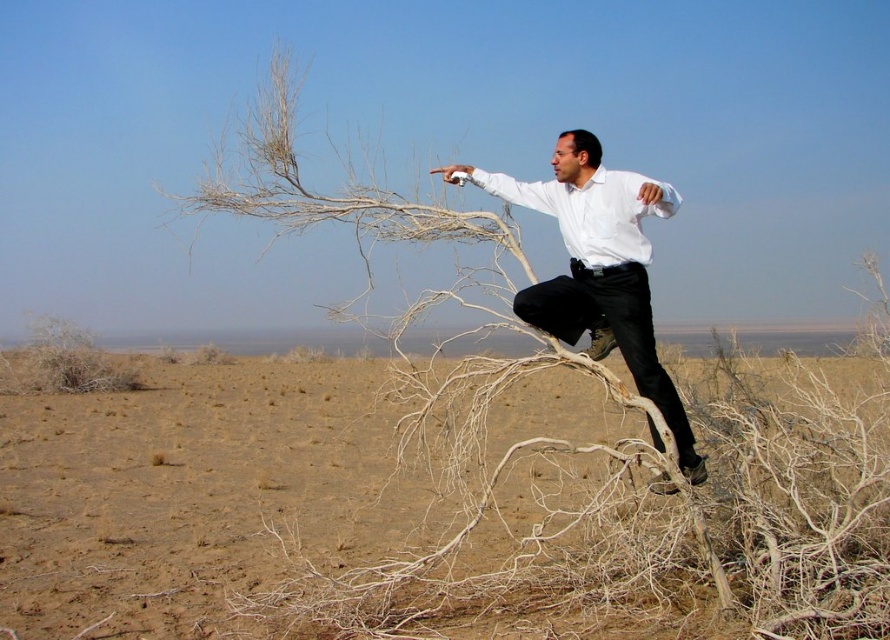
Question: Is brown sandy dirt at center to the right of white matte shirt at center from the viewer's perspective?

Choices:
 (A) yes
 (B) no

Answer: (B)

Question: Which is nearer to the white matte dress shirt at center?

Choices:
 (A) white matte shirt at center
 (B) brown sandy dirt at center

Answer: (A)

Question: In this image, where is brown sandy dirt at center located relative to white matte dress shirt at center?

Choices:
 (A) left
 (B) right

Answer: (A)

Question: Is white matte shirt at center to the right of white matte dress shirt at center from the viewer's perspective?

Choices:
 (A) yes
 (B) no

Answer: (A)

Question: Based on their relative distances, which object is farther from the white matte shirt at center?

Choices:
 (A) white matte dress shirt at center
 (B) brown sandy dirt at center

Answer: (B)

Question: Which object is farther from the camera taking this photo?

Choices:
 (A) white matte dress shirt at center
 (B) brown sandy dirt at center
 (C) white matte shirt at center

Answer: (A)